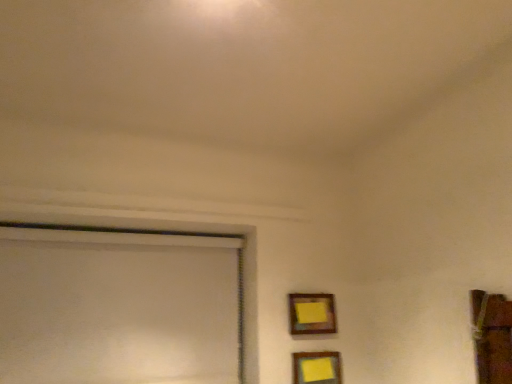
Question: Does wooden frame at lower right, the 1th picture frame viewed from the top, lie in front of wooden framed picture at lower center, the 1th picture frame positioned from the bottom?

Choices:
 (A) no
 (B) yes

Answer: (A)

Question: Does wooden frame at lower right, positioned as the 2th picture frame in bottom-to-top order, appear on the left side of wooden framed picture at lower center, marked as the second picture frame in a top-to-bottom arrangement?

Choices:
 (A) yes
 (B) no

Answer: (A)

Question: From a real-world perspective, is wooden frame at lower right, positioned as the 2th picture frame in bottom-to-top order, on top of wooden framed picture at lower center, the 1th picture frame positioned from the bottom?

Choices:
 (A) yes
 (B) no

Answer: (A)

Question: Does wooden frame at lower right, positioned as the 2th picture frame in bottom-to-top order, have a lesser height compared to wooden framed picture at lower center, the 1th picture frame positioned from the bottom?

Choices:
 (A) yes
 (B) no

Answer: (B)

Question: Can you confirm if wooden frame at lower right, positioned as the 2th picture frame in bottom-to-top order, is bigger than wooden framed picture at lower center, the 1th picture frame positioned from the bottom?

Choices:
 (A) yes
 (B) no

Answer: (B)

Question: Considering the relative positions of wooden frame at lower right, the 1th picture frame viewed from the top, and wooden framed picture at lower center, the 1th picture frame positioned from the bottom, in the image provided, is wooden frame at lower right, the 1th picture frame viewed from the top, to the right of wooden framed picture at lower center, the 1th picture frame positioned from the bottom, from the viewer's perspective?

Choices:
 (A) no
 (B) yes

Answer: (A)

Question: From the image's perspective, is wooden framed picture at lower center, marked as the second picture frame in a top-to-bottom arrangement, under wooden frame at lower right, positioned as the 2th picture frame in bottom-to-top order?

Choices:
 (A) yes
 (B) no

Answer: (A)

Question: Considering the relative sizes of wooden framed picture at lower center, the 1th picture frame positioned from the bottom, and wooden frame at lower right, positioned as the 2th picture frame in bottom-to-top order, in the image provided, is wooden framed picture at lower center, the 1th picture frame positioned from the bottom, bigger than wooden frame at lower right, positioned as the 2th picture frame in bottom-to-top order,?

Choices:
 (A) yes
 (B) no

Answer: (A)

Question: Can you confirm if wooden framed picture at lower center, the 1th picture frame positioned from the bottom, is smaller than wooden frame at lower right, the 1th picture frame viewed from the top?

Choices:
 (A) yes
 (B) no

Answer: (B)

Question: From the image's perspective, is wooden framed picture at lower center, the 1th picture frame positioned from the bottom, over wooden frame at lower right, the 1th picture frame viewed from the top?

Choices:
 (A) yes
 (B) no

Answer: (B)

Question: Is wooden framed picture at lower center, the 1th picture frame positioned from the bottom, to the left of wooden frame at lower right, the 1th picture frame viewed from the top, from the viewer's perspective?

Choices:
 (A) yes
 (B) no

Answer: (B)

Question: Considering the relative sizes of wooden framed picture at lower center, marked as the second picture frame in a top-to-bottom arrangement, and wooden frame at lower right, positioned as the 2th picture frame in bottom-to-top order, in the image provided, is wooden framed picture at lower center, marked as the second picture frame in a top-to-bottom arrangement, taller than wooden frame at lower right, positioned as the 2th picture frame in bottom-to-top order,?

Choices:
 (A) no
 (B) yes

Answer: (A)

Question: In terms of size, does wooden framed picture at lower center, marked as the second picture frame in a top-to-bottom arrangement, appear bigger or smaller than wooden frame at lower right, positioned as the 2th picture frame in bottom-to-top order?

Choices:
 (A) small
 (B) big

Answer: (B)